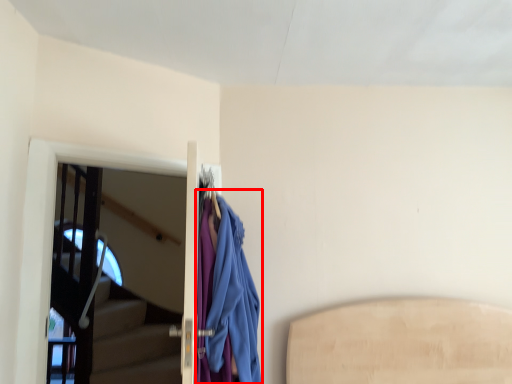
Question: From the image's perspective, where is cloak (annotated by the red box) located in relation to screen door in the image?

Choices:
 (A) below
 (B) above

Answer: (A)